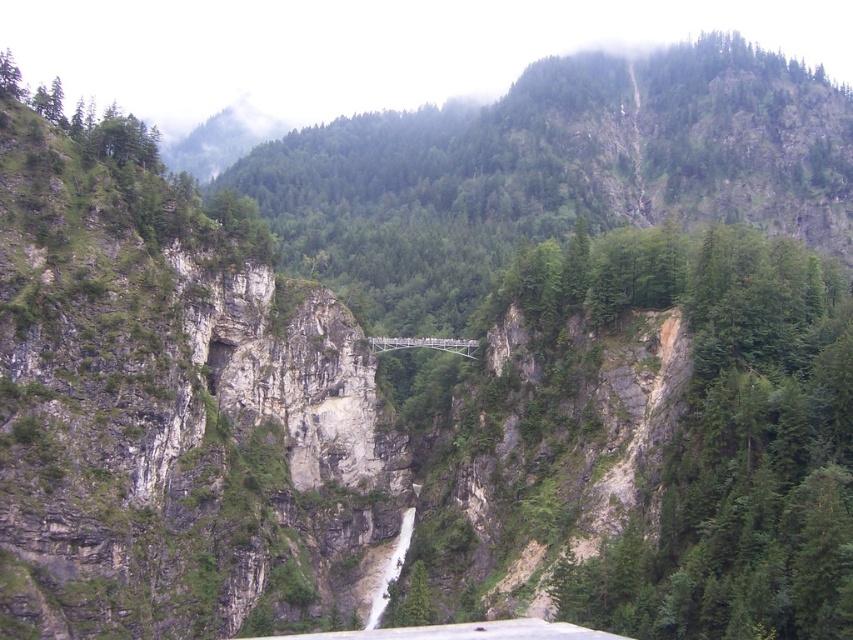
Between green rock cliff at center and green matte tree at center-right, which one appears on the left side from the viewer's perspective?

green rock cliff at center is more to the left.

Between green rock cliff at center and green matte tree at center-right, which one is positioned higher?

Positioned higher is green rock cliff at center.

Identify the location of green rock cliff at center. This screenshot has width=853, height=640. (x=169, y=401).

This screenshot has width=853, height=640. What are the coordinates of `green rock cliff at center` in the screenshot? It's located at (169, 401).

Is point (728, 253) in front of point (373, 340)?

Yes, point (728, 253) is closer to viewer.

Identify the location of green matte tree at center-right. Image resolution: width=853 pixels, height=640 pixels. (720, 435).

You are a GUI agent. You are given a task and a screenshot of the screen. Output one action in this format:
    pyautogui.click(x=<x>, y=<y>)
    Task: Click on the green matte tree at center-right
    The height and width of the screenshot is (640, 853).
    Given the screenshot: What is the action you would take?
    pyautogui.click(x=720, y=435)

The image size is (853, 640). What do you see at coordinates (169, 401) in the screenshot? I see `green rock cliff at center` at bounding box center [169, 401].

Can you confirm if green rock cliff at center is wider than metallic gray bridge at center?

Yes, green rock cliff at center is wider than metallic gray bridge at center.

Image resolution: width=853 pixels, height=640 pixels. Describe the element at coordinates (169, 401) in the screenshot. I see `green rock cliff at center` at that location.

Locate an element on the screen. green rock cliff at center is located at coordinates (169, 401).